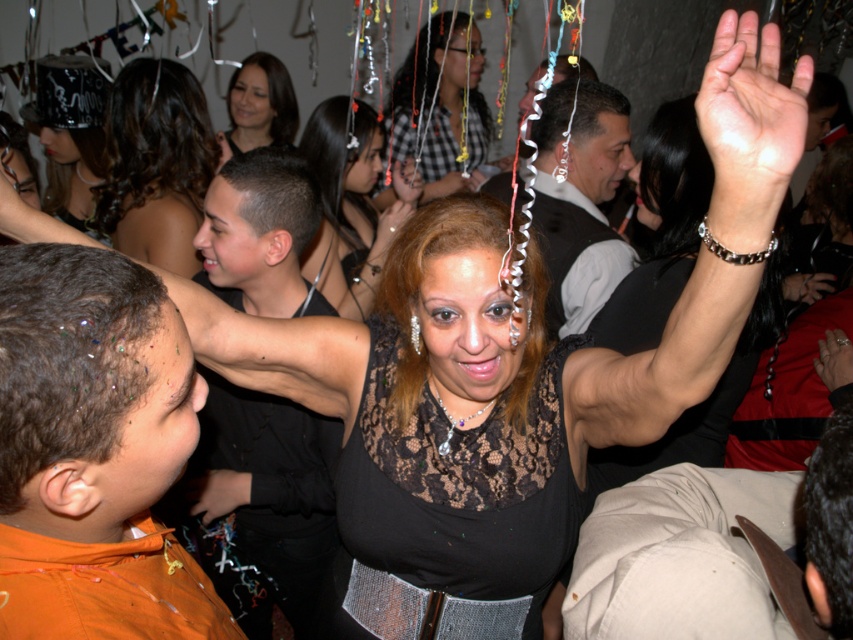
In the party scene, you see two shirts at the center of the image. The shiny black shirt at center and the checkered fabric shirt at center. Which one is positioned to the left?

The shiny black shirt at center is to the left of the checkered fabric shirt at center.

You are at the point labeled point (155, 163) in the image. What object is directly beneath you?

The point (155, 163) is on shiny black hair at center, so the object directly beneath you is the shiny black hair at center.

Looking at this image, you are at a party and want to take a photo of both the shiny black shirt at center and the dark brown hair at upper center. Which object should you focus on first to ensure both are in clear view?

You should focus on the shiny black shirt at center first because it is closer to you than the dark brown hair at upper center. By focusing on the closer object, both will be in focus due to the depth of field.